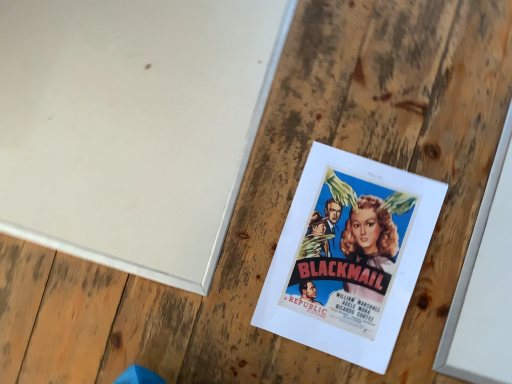
Locate an element on the screen. This screenshot has width=512, height=384. empty space that is ontop of matte paper poster at center (from a real-world perspective) is located at coordinates (350, 253).